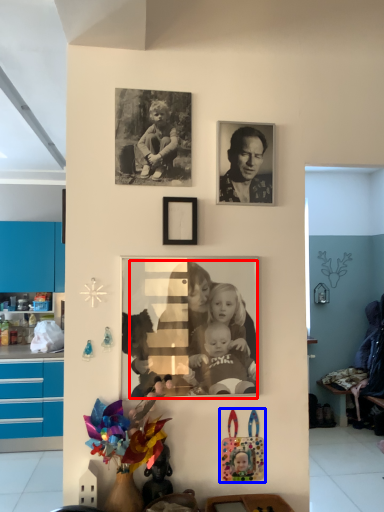
Question: Which object is closer to the camera taking this photo, person (highlighted by a red box) or toy (highlighted by a blue box)?

Choices:
 (A) person
 (B) toy

Answer: (A)